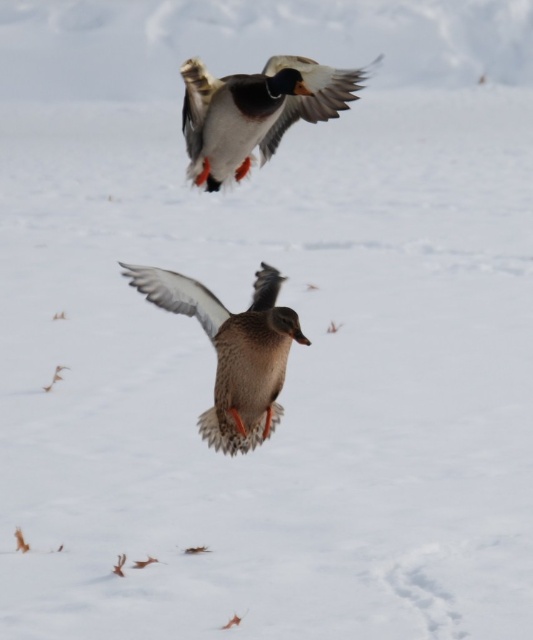
You are a birdwatcher observing the two ducks in the image. Which duck, the brown feathered duck at center or the speckled feathered duck at upper center, would you estimate to be bigger in size?

The brown feathered duck at center has a larger size compared to the speckled feathered duck at upper center, so the brown feathered duck at center is bigger.

You are a birdwatcher observing two ducks in flight. You notice the brown feathered duck at center and the speckled feathered duck at upper center. Which duck has a smaller wingspan?

The brown feathered duck at center has a lesser width compared to the speckled feathered duck at upper center, so the brown feathered duck at center has a smaller wingspan.